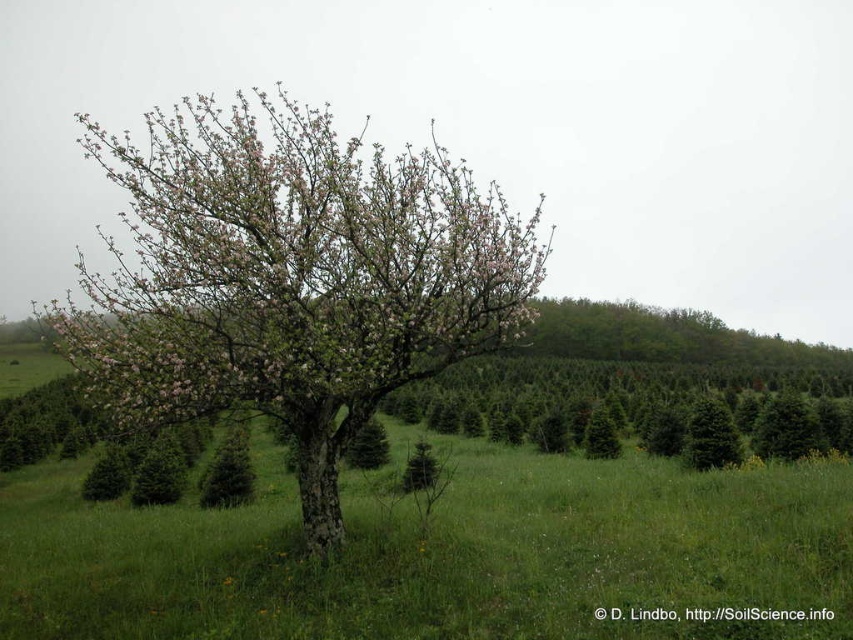
You are standing in the field of evergreen trees and see the green grassy at center and the pink bloom at center. Which object is located to the right side from your perspective?

The green grassy at center is to the right of the pink bloom at center.

You are a gardener who wants to plant a new flower bed between the green grassy at center and the pink bloom at center. Which area should you choose to ensure the flowers will be visible above the existing vegetation?

The gardener should choose the area near the pink bloom at center because the green grassy at center has a lesser height compared to the pink bloom at center. This means the pink bloom area is taller, so planting there ensures the new flowers will be visible above the existing vegetation.